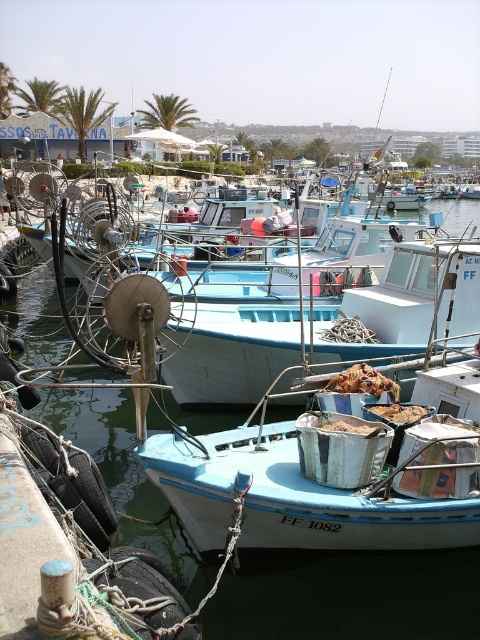
Question: Is light blue painted wood boat at center smaller than blue water at center?

Choices:
 (A) no
 (B) yes

Answer: (B)

Question: Is light blue painted wood boat at center above white matte boat at center?

Choices:
 (A) yes
 (B) no

Answer: (B)

Question: Considering the relative positions of light blue painted wood boat at center and white matte boat at center in the image provided, where is light blue painted wood boat at center located with respect to white matte boat at center?

Choices:
 (A) below
 (B) above

Answer: (A)

Question: Which of the following is the farthest from the observer?

Choices:
 (A) (321, 605)
 (B) (204, 515)
 (C) (357, 340)

Answer: (C)

Question: Which point is farther from the camera taking this photo?

Choices:
 (A) (343, 502)
 (B) (396, 580)
 (C) (422, 316)

Answer: (C)

Question: Which point appears farthest from the camera in this image?

Choices:
 (A) (407, 540)
 (B) (46, 282)
 (C) (273, 317)

Answer: (B)